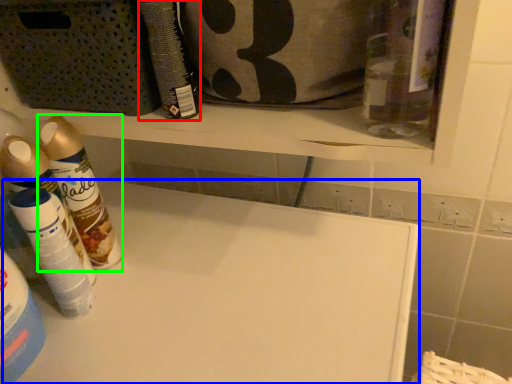
Question: Estimate the real-world distances between objects in this image. Which object is farther from cleaning product (highlighted by a red box), counter (highlighted by a blue box) or cleaning product (highlighted by a green box)?

Choices:
 (A) counter
 (B) cleaning product

Answer: (A)